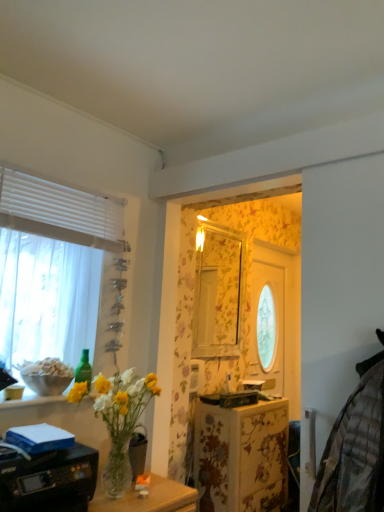
Question: From the image's perspective, is clear glass vase at lower center positioned above or below green glass bottle at upper left?

Choices:
 (A) above
 (B) below

Answer: (B)

Question: Is clear glass vase at lower center wider or thinner than green glass bottle at upper left?

Choices:
 (A) thin
 (B) wide

Answer: (B)

Question: Which of these objects is positioned farthest from the black plastic printer at lower left?

Choices:
 (A) green glass bottle at upper left
 (B) clear glass vase at lower left
 (C) white sheer curtain at left
 (D) clear glass vase at lower center

Answer: (C)

Question: Which of these objects is positioned farthest from the green glass bottle at upper left?

Choices:
 (A) black plastic printer at lower left
 (B) white sheer curtain at left
 (C) clear glass vase at lower center
 (D) clear glass vase at lower left

Answer: (B)